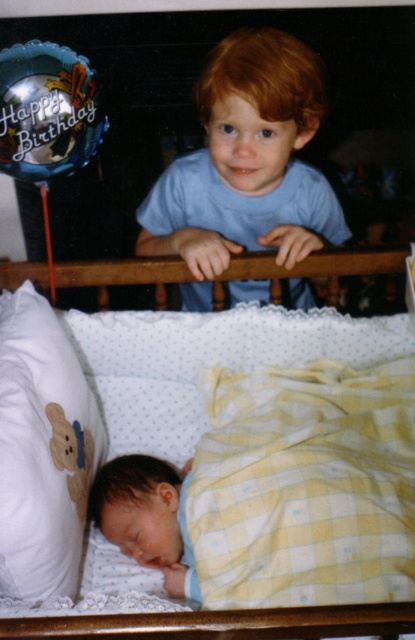
You are a photographer standing at the camera position. You want to place a small decoration between the white soft pillow at lower left and the camera. The decoration requires a minimum of 30 inches of space. Is there enough space for it?

The distance between the white soft pillow at lower left and the camera is 36.97 inches, which is more than the required 30 inches. Therefore, there is enough space to place the decoration.

You are a photographer trying to capture a closeup of the blue cotton shirt at upper center. Given that your camera can focus on objects within 3 feet, will you need to move closer or farther away to get a clear shot?

The blue cotton shirt at upper center is 3.82 feet from the camera, which is beyond the 3 feet focus range. Therefore, you need to move closer to bring it within the 3 feet range for a clear shot.